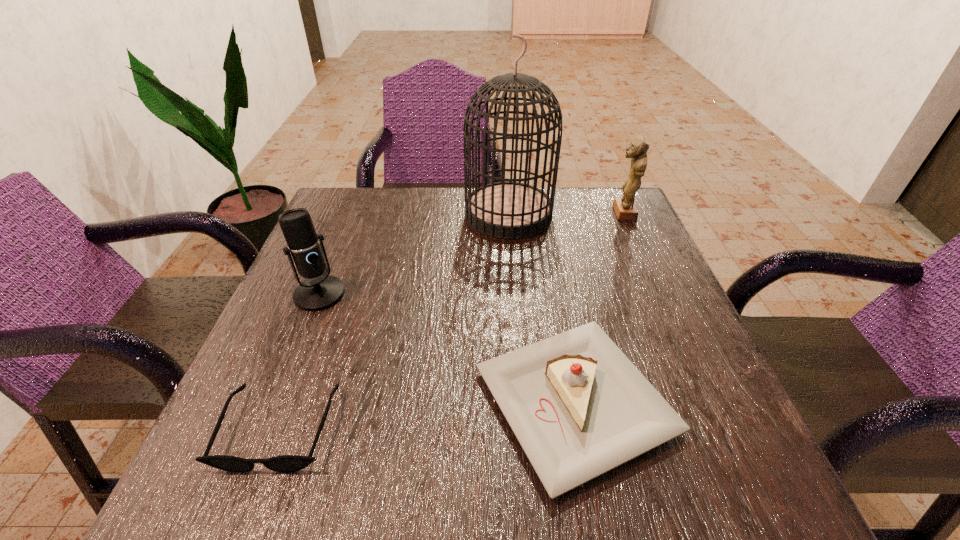
In order to click on object positioned at the far right corner in this screenshot , I will do `click(625, 209)`.

Find the location of `object at the near right corner`. object at the near right corner is located at coordinates (579, 408).

At what (x,y) coordinates should I click in order to perform the action: click on vacant space at the far edge. Please return your answer as a coordinate pair (x, y). This screenshot has width=960, height=540. Looking at the image, I should click on (446, 191).

This screenshot has width=960, height=540. In order to click on free region at the near edge in this screenshot , I will do `click(375, 505)`.

Find the location of a particular element. The width and height of the screenshot is (960, 540). free location at the left edge of the desktop is located at coordinates (241, 405).

I want to click on vacant space at the right edge of the desktop, so click(x=608, y=240).

The height and width of the screenshot is (540, 960). In the image, there is a desktop. Identify the location of vacant area at the far right corner. (626, 233).

I want to click on free location at the near right corner of the desktop, so click(x=743, y=446).

The image size is (960, 540). Identify the location of vacant space that's between the rightmost object and the cake. (599, 307).

Find the location of a particular element. vacant space in between the third nearest object and the tallest object is located at coordinates pos(414,254).